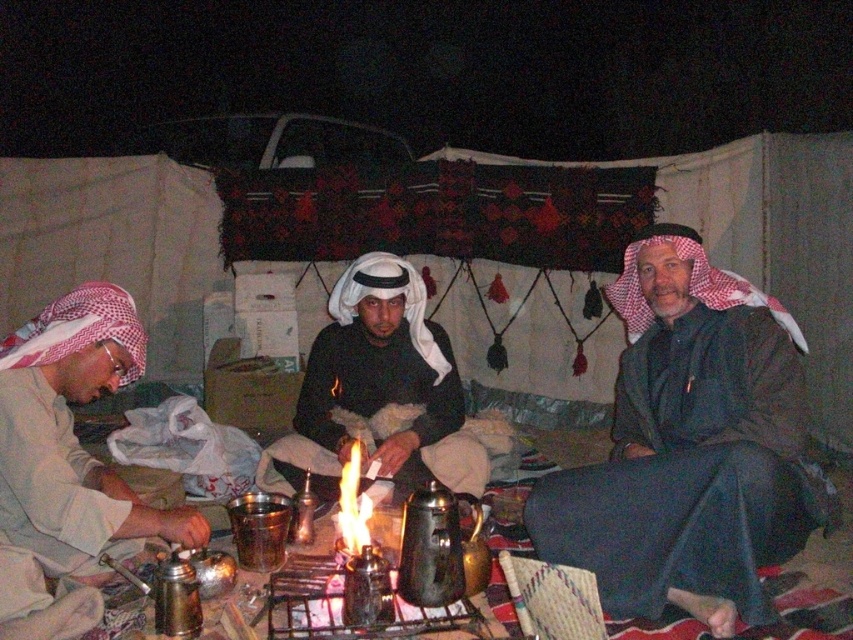
You are a photographer standing in front of the scene. You want to take a photo that includes both the point at [717,372] and the point at [3,484]. Which point should you focus on first to ensure both are in focus?

You should focus on the point at [717,372] first because it is closer to the camera than the point at [3,484], ensuring both will be in focus when using a suitable aperture.

You are a photographer trying to capture the scene of the three men around the fire. You want to ensure that both the dark green fabric at center and the white fabric headscarf at left are clearly visible in your photo. Given their heights, which object will appear larger in the photo?

The dark green fabric at center will appear larger in the photo because it has a greater height compared to the white fabric headscarf at left.